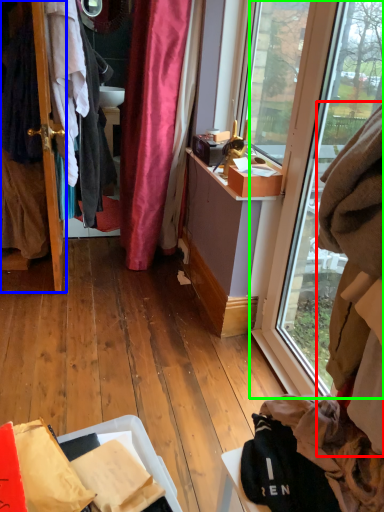
Question: Based on their relative distances, which object is farther from clothing (highlighted by a red box)? Choose from door (highlighted by a blue box) and window (highlighted by a green box).

Choices:
 (A) door
 (B) window

Answer: (A)